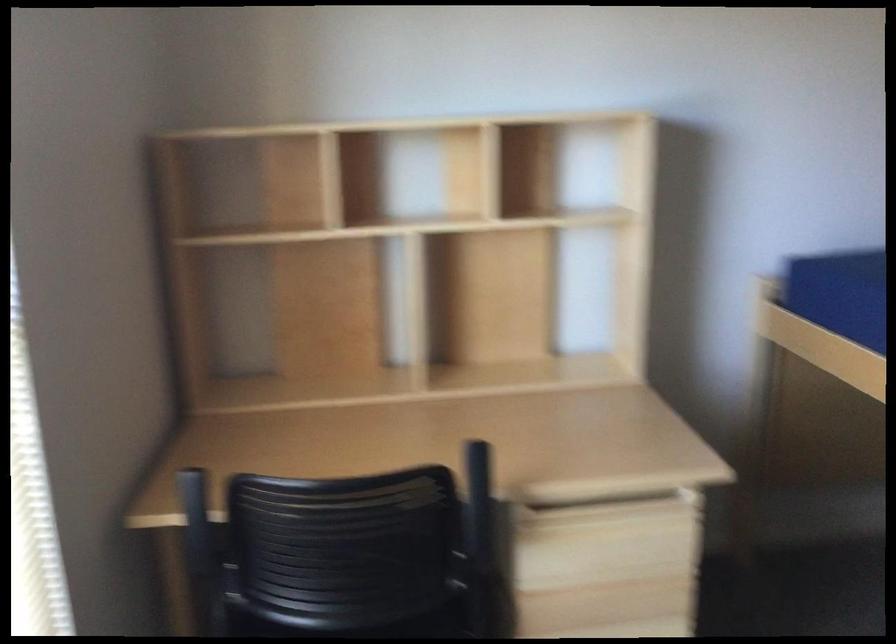
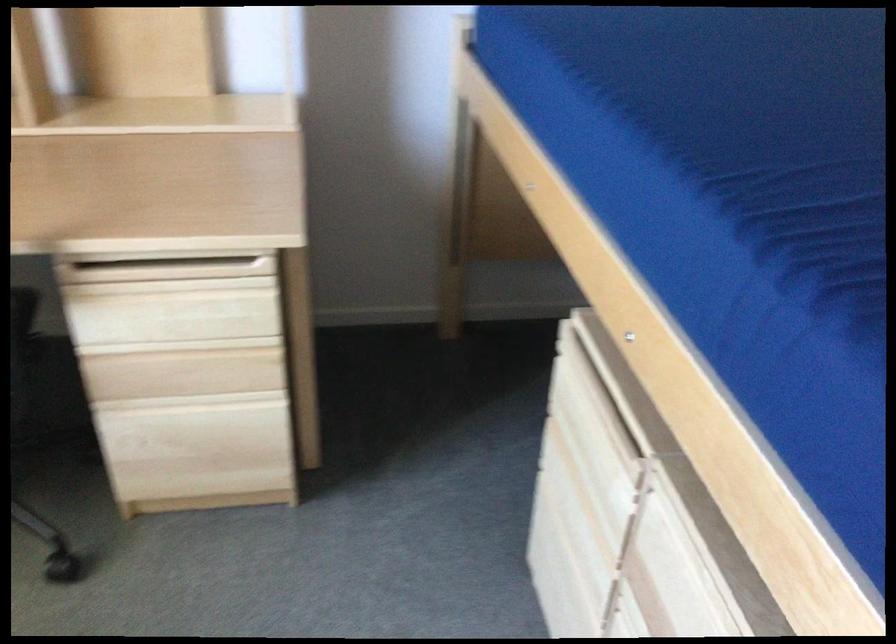
Question: The first image is from the beginning of the video and the second image is from the end. How did the camera likely rotate when shooting the video?

Choices:
 (A) Left
 (B) Right
 (C) Up
 (D) Down

Answer: (D)